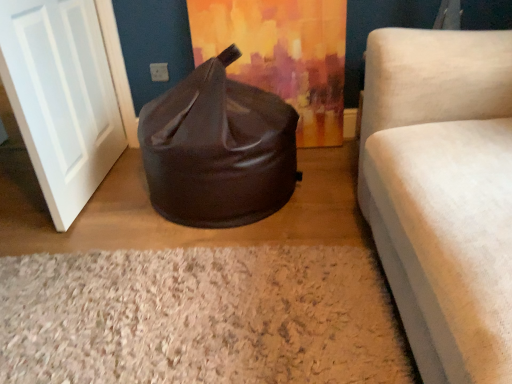
What is the approximate width of white matte door at left?

white matte door at left is 5.53 inches wide.

What is the approximate width of white shaggy rug at lower center?

white shaggy rug at lower center is 4.49 feet in width.

The width and height of the screenshot is (512, 384). What do you see at coordinates (282, 55) in the screenshot? I see `brown leather bean bag at center` at bounding box center [282, 55].

Identify the location of brown leather bean bag at center. (218, 149).

Considering the sizes of objects brown leather bean bag at center and white shaggy rug at lower center in the image provided, who is taller, brown leather bean bag at center or white shaggy rug at lower center?

brown leather bean bag at center.

Does brown leather bean bag at center have a greater width compared to white shaggy rug at lower center?

No, brown leather bean bag at center is not wider than white shaggy rug at lower center.

Which is closer to the camera, [214,192] or [243,380]?

The point [243,380] is closer to the camera.

Which object is closer to the camera taking this photo, white shaggy rug at lower center or brown leather bean bag at center?

white shaggy rug at lower center is in front.

I want to click on granite that appears in front of the brown leather bean bag at center, so click(199, 317).

Considering the relative sizes of white shaggy rug at lower center and brown leather bean bag at center in the image provided, is white shaggy rug at lower center shorter than brown leather bean bag at center?

Indeed, white shaggy rug at lower center has a lesser height compared to brown leather bean bag at center.

Which is nearer, (228, 376) or (262, 198)?

The point (228, 376) is in front.

Does white matte door at left have a larger size compared to white shaggy rug at lower center?

Indeed, white matte door at left has a larger size compared to white shaggy rug at lower center.

Does white matte door at left turn towards white shaggy rug at lower center?

No, white matte door at left does not turn towards white shaggy rug at lower center.

In the scene shown: Which object is wider, white matte door at left or white shaggy rug at lower center?

white shaggy rug at lower center.

Is white matte door at left positioned behind white shaggy rug at lower center?

Yes, it is behind white shaggy rug at lower center.

Is white matte door at left positioned with its back to brown leather bean bag at center?

Correct, white matte door at left is looking away from brown leather bean bag at center.

The height and width of the screenshot is (384, 512). What are the coordinates of `curtain on the right of white matte door at left` in the screenshot? It's located at (282, 55).

Consider the image. From a real-world perspective, is white matte door at left under brown leather bean bag at center?

No, from a real-world perspective, white matte door at left is not beneath brown leather bean bag at center.

Can you confirm if white matte door at left is shorter than brown leather bean bag at center?

No.

Between brown leather bean bag at center and white shaggy rug at lower center, which one appears on the right side from the viewer's perspective?

brown leather bean bag at center.

From a real-world perspective, is brown leather bean bag at center positioned under white shaggy rug at lower center based on gravity?

Incorrect, from a real-world perspective, brown leather bean bag at center is higher than white shaggy rug at lower center.

Find the location of a particular element. Image resolution: width=512 pixels, height=384 pixels. granite in front of the brown leather bean bag at center is located at coordinates (199, 317).

In terms of height, does brown leather bean bag at center look taller or shorter compared to white shaggy rug at lower center?

Clearly, brown leather bean bag at center is taller compared to white shaggy rug at lower center.

Which object is positioned more to the right, white shaggy rug at lower center or white matte door at left?

white shaggy rug at lower center.

Find the location of `door that is above the white shaggy rug at lower center (from a real-world perspective)`. door that is above the white shaggy rug at lower center (from a real-world perspective) is located at coordinates (61, 98).

Is white shaggy rug at lower center positioned far away from white matte door at left?

No, there isn't a large distance between white shaggy rug at lower center and white matte door at left.

From the image's perspective, is white shaggy rug at lower center above white matte door at left?

No.

Is white matte door at left located within brown leather bean bag at center?

No.

Does brown leather bean bag at center have a greater height compared to white matte door at left?

No, brown leather bean bag at center is not taller than white matte door at left.

Does brown leather bean bag at center turn towards white matte door at left?

No, brown leather bean bag at center does not turn towards white matte door at left.

Can you confirm if brown leather bean bag at center is bigger than white matte door at left?

Incorrect, brown leather bean bag at center is not larger than white matte door at left.

In order to click on granite located in front of the brown leather bean bag at center in this screenshot , I will do tap(199, 317).

What are the coordinates of `granite that is on the left side of brown leather bean bag at center` in the screenshot? It's located at (199, 317).

From the image, which object appears to be farther from white shaggy rug at lower center, brown leather bean bag at center or brown leather bean bag at center?

Among the two, brown leather bean bag at center is located further to white shaggy rug at lower center.

From the picture: Considering their positions, is white shaggy rug at lower center positioned closer to brown leather bean bag at center than brown leather bean bag at center?

Based on the image, white shaggy rug at lower center appears to be nearer to brown leather bean bag at center.

From the picture: Based on their spatial positions, is white shaggy rug at lower center or white matte door at left further from brown leather bean bag at center?

white matte door at left.

From the image, which object appears to be farther from white shaggy rug at lower center, brown leather bean bag at center or white matte door at left?

white matte door at left is positioned further to the anchor white shaggy rug at lower center.

Estimate the real-world distances between objects in this image. Which object is further from brown leather bean bag at center, white matte door at left or brown leather bean bag at center?

white matte door at left lies further to brown leather bean bag at center than the other object.

Based on their spatial positions, is white shaggy rug at lower center or white matte door at left closer to brown leather bean bag at center?

Among the two, white matte door at left is located nearer to brown leather bean bag at center.

Looking at the image, which one is located further to white shaggy rug at lower center, brown leather bean bag at center or white matte door at left?

brown leather bean bag at center lies further to white shaggy rug at lower center than the other object.

Based on their spatial positions, is brown leather bean bag at center or white matte door at left closer to brown leather bean bag at center?

brown leather bean bag at center lies closer to brown leather bean bag at center than the other object.

The image size is (512, 384). I want to click on bean bag chair between brown leather bean bag at center and white shaggy rug at lower center in the up-down direction, so click(x=218, y=149).

This screenshot has width=512, height=384. In order to click on door between brown leather bean bag at center and white shaggy rug at lower center in the up-down direction in this screenshot , I will do `click(61, 98)`.

The image size is (512, 384). In order to click on bean bag chair that lies between white matte door at left and white shaggy rug at lower center from top to bottom in this screenshot , I will do `click(218, 149)`.

Identify the location of bean bag chair located between white matte door at left and brown leather bean bag at center in the left-right direction. (218, 149).